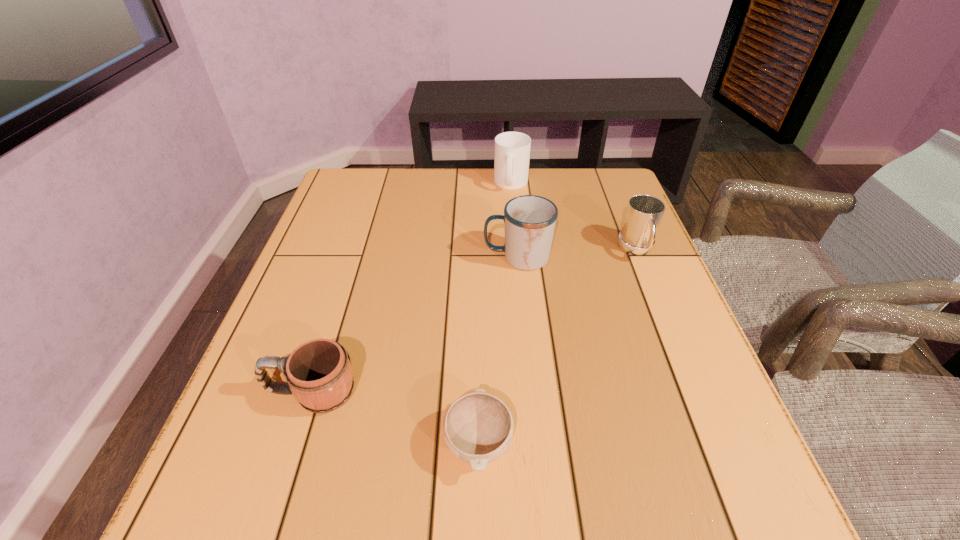
What are the coordinates of `object at the left edge` in the screenshot? It's located at (319, 374).

Where is `object at the right edge`? object at the right edge is located at coordinates (644, 213).

Find the location of a particular element. Image resolution: width=960 pixels, height=540 pixels. vacant space at the far edge of the desktop is located at coordinates (475, 172).

The height and width of the screenshot is (540, 960). What are the coordinates of `vacant space at the near edge of the desktop` in the screenshot? It's located at click(551, 508).

Locate an element on the screen. free space at the left edge is located at coordinates click(315, 441).

Locate an element on the screen. The height and width of the screenshot is (540, 960). blank space at the right edge is located at coordinates (612, 238).

Where is `vacant space at the far left corner of the desktop`? This screenshot has height=540, width=960. vacant space at the far left corner of the desktop is located at coordinates (383, 204).

The height and width of the screenshot is (540, 960). In the image, there is a desktop. Find the location of `vacant region at the far right corner`. vacant region at the far right corner is located at coordinates (585, 210).

Find the location of a particular element. blank region between the farthest object and the nearest mug is located at coordinates (412, 288).

Find the location of a particular element. This screenshot has height=540, width=960. vacant region between the farthest mug and the rightmost object is located at coordinates (574, 217).